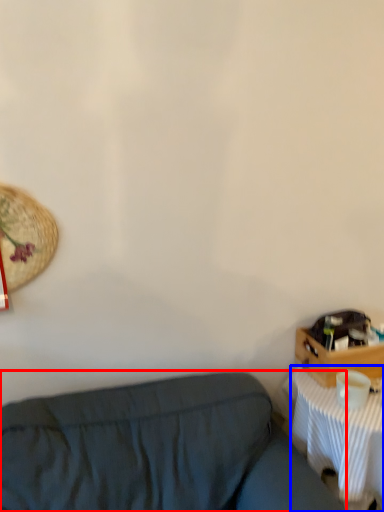
Question: Which object is closer to the camera taking this photo, studio couch (highlighted by a red box) or desk (highlighted by a blue box)?

Choices:
 (A) studio couch
 (B) desk

Answer: (A)